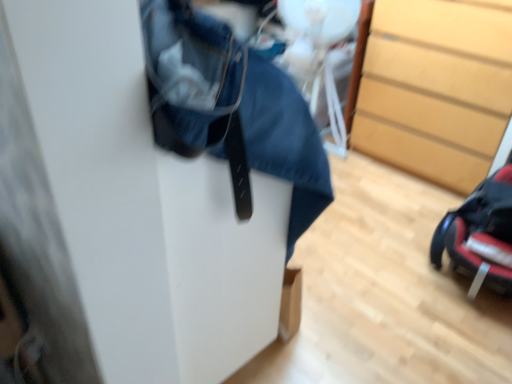
The image size is (512, 384). I want to click on black plastic baby carriage at lower right, so click(x=480, y=234).

The height and width of the screenshot is (384, 512). Describe the element at coordinates (480, 234) in the screenshot. I see `black plastic baby carriage at lower right` at that location.

Find the location of `wooden chest of drawers at right`. wooden chest of drawers at right is located at coordinates tap(436, 89).

Image resolution: width=512 pixels, height=384 pixels. Describe the element at coordinates (436, 89) in the screenshot. I see `wooden chest of drawers at right` at that location.

Measure the distance between wooden chest of drawers at right and camera.

The depth of wooden chest of drawers at right is 6.12 feet.

Locate an element on the screen. black plastic baby carriage at lower right is located at coordinates (480, 234).

Can you confirm if black plastic baby carriage at lower right is positioned to the left of wooden chest of drawers at right?

Yes, black plastic baby carriage at lower right is to the left of wooden chest of drawers at right.

Which object is closer to the camera, black plastic baby carriage at lower right or wooden chest of drawers at right?

Positioned in front is black plastic baby carriage at lower right.

Is point (434, 261) positioned behind point (429, 173)?

No, (434, 261) is closer to viewer.

From the image's perspective, is black plastic baby carriage at lower right located above or below wooden chest of drawers at right?

Clearly, from the image's perspective, black plastic baby carriage at lower right is below wooden chest of drawers at right.

From a real-world perspective, which is physically below, black plastic baby carriage at lower right or wooden chest of drawers at right?

From a 3D spatial view, black plastic baby carriage at lower right is below.

Considering the sizes of objects black plastic baby carriage at lower right and wooden chest of drawers at right in the image provided, who is thinner, black plastic baby carriage at lower right or wooden chest of drawers at right?

Thinner between the two is black plastic baby carriage at lower right.

Considering the sizes of objects black plastic baby carriage at lower right and wooden chest of drawers at right in the image provided, who is shorter, black plastic baby carriage at lower right or wooden chest of drawers at right?

black plastic baby carriage at lower right.

Between black plastic baby carriage at lower right and wooden chest of drawers at right, which one has larger size?

With larger size is wooden chest of drawers at right.

Is black plastic baby carriage at lower right situated inside wooden chest of drawers at right or outside?

black plastic baby carriage at lower right lies outside wooden chest of drawers at right.

Is black plastic baby carriage at lower right directly adjacent to wooden chest of drawers at right?

They are not placed beside each other.

Is black plastic baby carriage at lower right turned away from wooden chest of drawers at right?

That's not correct — black plastic baby carriage at lower right is not looking away from wooden chest of drawers at right.

The width and height of the screenshot is (512, 384). Find the location of `baby carriage on the left of wooden chest of drawers at right`. baby carriage on the left of wooden chest of drawers at right is located at coordinates point(480,234).

Does wooden chest of drawers at right appear on the right side of black plastic baby carriage at lower right?

Yes, wooden chest of drawers at right is to the right of black plastic baby carriage at lower right.

Is wooden chest of drawers at right closer to the viewer compared to black plastic baby carriage at lower right?

No, it is not.

Considering the positions of point (428, 21) and point (490, 272), is point (428, 21) closer or farther from the camera than point (490, 272)?

Point (428, 21) is positioned farther from the camera compared to point (490, 272).

From the image's perspective, does wooden chest of drawers at right appear higher than black plastic baby carriage at lower right?

Yes, from the image's perspective, wooden chest of drawers at right is above black plastic baby carriage at lower right.

From a real-world perspective, is wooden chest of drawers at right on black plastic baby carriage at lower right?

Yes.

Is wooden chest of drawers at right wider than black plastic baby carriage at lower right?

Indeed, wooden chest of drawers at right has a greater width compared to black plastic baby carriage at lower right.

Can you confirm if wooden chest of drawers at right is taller than black plastic baby carriage at lower right?

Yes.

Which of these two, wooden chest of drawers at right or black plastic baby carriage at lower right, is smaller?

With smaller size is black plastic baby carriage at lower right.

Is wooden chest of drawers at right outside of black plastic baby carriage at lower right?

Yes, wooden chest of drawers at right is not within black plastic baby carriage at lower right.

Are wooden chest of drawers at right and black plastic baby carriage at lower right located far from each other?

They are positioned close to each other.

Is black plastic baby carriage at lower right at the back of wooden chest of drawers at right?

wooden chest of drawers at right is not turned away from black plastic baby carriage at lower right.

Find the location of a particular element. chest of drawers to the right of black plastic baby carriage at lower right is located at coordinates (436, 89).

Locate an element on the screen. The height and width of the screenshot is (384, 512). chest of drawers on the right of black plastic baby carriage at lower right is located at coordinates (436, 89).

The width and height of the screenshot is (512, 384). I want to click on chest of drawers above the black plastic baby carriage at lower right (from the image's perspective), so click(x=436, y=89).